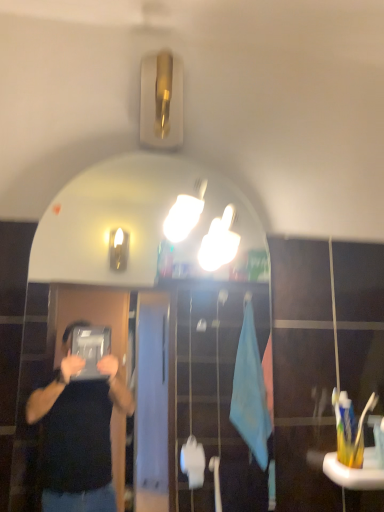
Question: From the image's perspective, relative to yellow plastic toothbrush at lower right, positioned as the 2th toothbrush in left-to-right order, is white plastic toothbrush at right, which is counted as the 1th toothbrush, starting from the left, above or below?

Choices:
 (A) above
 (B) below

Answer: (A)

Question: Is white plastic toothbrush at right, the 3th toothbrush from the right, bigger or smaller than yellow plastic toothbrush at lower right, the second toothbrush from the right?

Choices:
 (A) small
 (B) big

Answer: (A)

Question: Estimate the real-world distances between objects in this image. Which object is farther from the white plastic toothbrush at right, which is counted as the 1th toothbrush, starting from the left?

Choices:
 (A) white glossy mirror at upper center
 (B) yellow plastic toothbrush at lower right, the third toothbrush from the left
 (C) yellow plastic toothbrush at lower right, the second toothbrush from the right

Answer: (A)

Question: Considering the real-world distances, which object is farthest from the white plastic toothbrush at right, which is counted as the 1th toothbrush, starting from the left?

Choices:
 (A) white glossy mirror at upper center
 (B) yellow plastic toothbrush at lower right, the third toothbrush from the left
 (C) yellow plastic toothbrush at lower right, positioned as the 2th toothbrush in left-to-right order

Answer: (A)